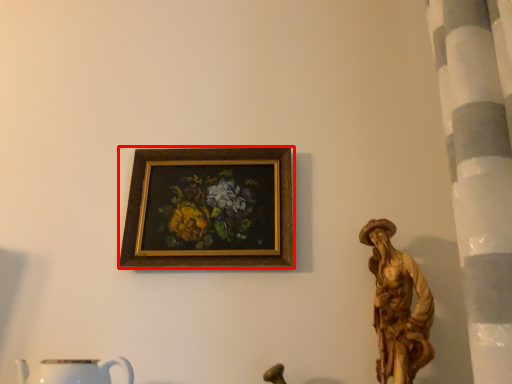
Question: Where is picture frame (annotated by the red box) located in relation to mug in the image?

Choices:
 (A) left
 (B) right

Answer: (B)